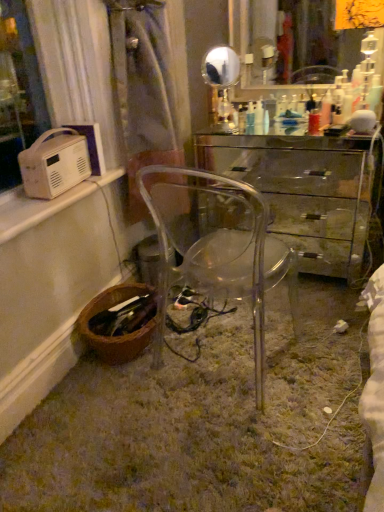
Question: Should I look upward or downward to see transparent plastic chair at center?

Choices:
 (A) up
 (B) down

Answer: (B)

Question: Can you confirm if gold metallic mirror at upper center, the 1th mirror when ordered from left to right, is bigger than brown woven basket at lower left?

Choices:
 (A) yes
 (B) no

Answer: (A)

Question: From a real-world perspective, is gold metallic mirror at upper center, which is counted as the second mirror, starting from the right, beneath brown woven basket at lower left?

Choices:
 (A) yes
 (B) no

Answer: (B)

Question: From the image's perspective, is gold metallic mirror at upper center, which is counted as the second mirror, starting from the right, on brown woven basket at lower left?

Choices:
 (A) no
 (B) yes

Answer: (B)

Question: Is gold metallic mirror at upper center, the 1th mirror when ordered from left to right, taller than brown woven basket at lower left?

Choices:
 (A) no
 (B) yes

Answer: (B)

Question: From the image's perspective, does gold metallic mirror at upper center, which is counted as the second mirror, starting from the right, appear lower than brown woven basket at lower left?

Choices:
 (A) yes
 (B) no

Answer: (B)

Question: Considering the relative positions of gold metallic mirror at upper center, the 1th mirror when ordered from left to right, and brown woven basket at lower left in the image provided, is gold metallic mirror at upper center, the 1th mirror when ordered from left to right, to the left of brown woven basket at lower left from the viewer's perspective?

Choices:
 (A) yes
 (B) no

Answer: (B)

Question: Is white plastic radio at left, which appears as the first appliance when viewed from the front, further to the viewer compared to transparent plastic chair at center?

Choices:
 (A) no
 (B) yes

Answer: (B)

Question: Does white plastic radio at left, which appears as the first appliance when viewed from the front, appear on the right side of transparent plastic chair at center?

Choices:
 (A) yes
 (B) no

Answer: (B)

Question: From the image's perspective, does white plastic radio at left, the second appliance from the back, appear lower than transparent plastic chair at center?

Choices:
 (A) no
 (B) yes

Answer: (A)

Question: Is white plastic radio at left, which appears as the first appliance when viewed from the front, located outside transparent plastic chair at center?

Choices:
 (A) no
 (B) yes

Answer: (B)

Question: Considering the relative sizes of white plastic radio at left, the second appliance from the back, and transparent plastic chair at center in the image provided, is white plastic radio at left, the second appliance from the back, wider than transparent plastic chair at center?

Choices:
 (A) no
 (B) yes

Answer: (A)

Question: Does white plastic radio at left, which appears as the first appliance when viewed from the front, have a greater height compared to transparent plastic chair at center?

Choices:
 (A) no
 (B) yes

Answer: (A)

Question: Considering the relative sizes of white plastic radio at upper left, positioned as the 1th appliance in back-to-front order, and transparent glass desk at center in the image provided, is white plastic radio at upper left, positioned as the 1th appliance in back-to-front order, smaller than transparent glass desk at center?

Choices:
 (A) no
 (B) yes

Answer: (B)